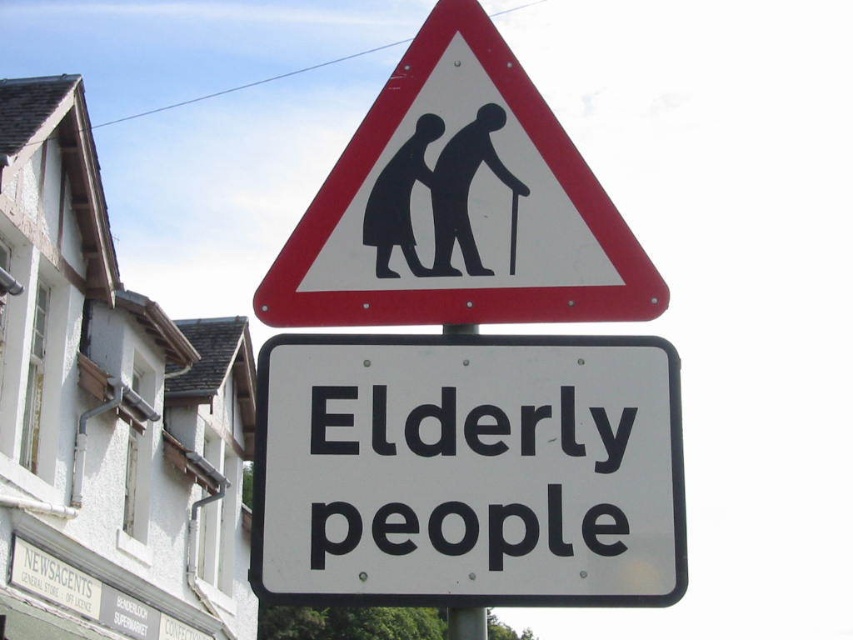
What do you see at coordinates (468, 470) in the screenshot? The width and height of the screenshot is (853, 640). I see `white plastic sign at center` at bounding box center [468, 470].

Which is behind, point (451, 532) or point (616, 260)?

The point (616, 260) is more distant.

Is point (363, 346) farther from camera compared to point (329, 243)?

No, (363, 346) is closer to viewer.

Locate an element on the screen. white plastic sign at center is located at coordinates pos(468,470).